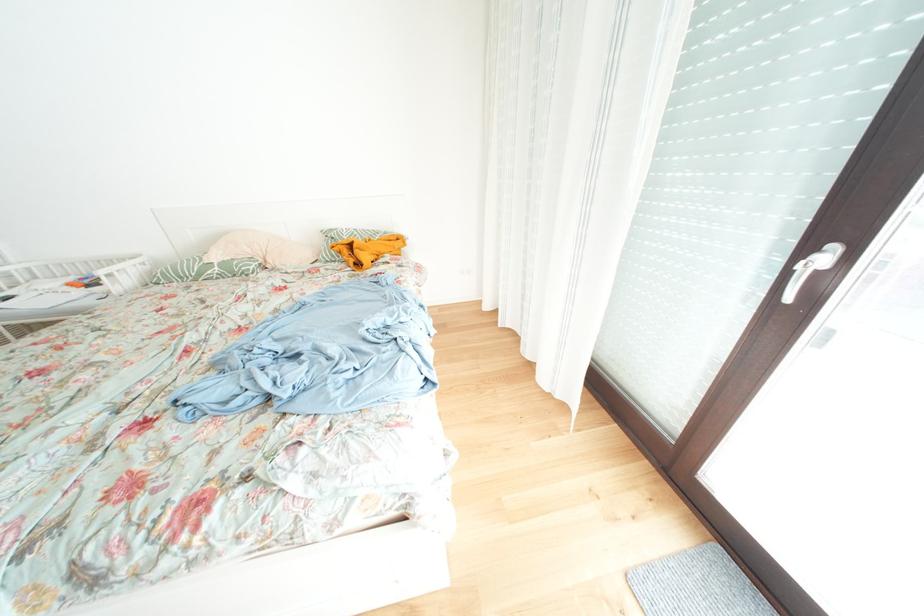
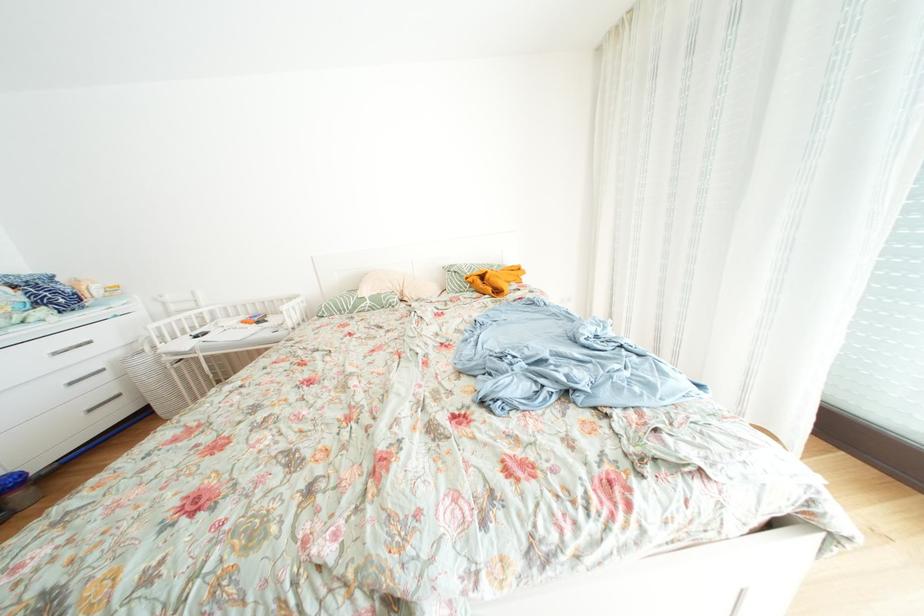
In the second image, find the point that corresponds to pixel 225 273 in the first image.

(378, 307)